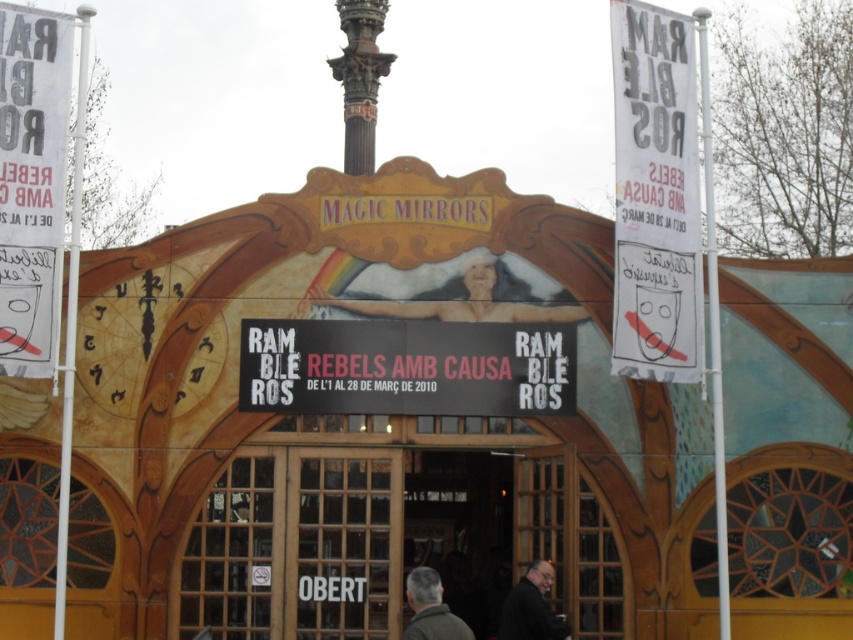
Which of these two, dark gray suit at lower center or gray woolen jacket at lower center, stands shorter?

With less height is dark gray suit at lower center.

This screenshot has height=640, width=853. Identify the location of dark gray suit at lower center. (531, 608).

Which of these two, white paper banner at upper right or smooth skin figure at center, stands shorter?

smooth skin figure at center is shorter.

Based on the photo, which is below, white paper banner at upper right or smooth skin figure at center?

Positioned lower is smooth skin figure at center.

Identify the location of white paper banner at upper right. (654, 196).

This screenshot has height=640, width=853. I want to click on white paper banner at upper right, so click(x=654, y=196).

Is wooden door at center closer to the viewer compared to white paper banner at left?

No, it is behind white paper banner at left.

Measure the distance between point (267,612) and camera.

Point (267,612) and camera are 244.14 feet apart from each other.

Is point (480, 577) more distant than point (9, 212)?

Yes, it is.

You are a GUI agent. You are given a task and a screenshot of the screen. Output one action in this format:
    pyautogui.click(x=<x>, y=<y>)
    Task: Click on the wooden door at center
    The image size is (853, 640).
    Given the screenshot: What is the action you would take?
    pyautogui.click(x=392, y=541)